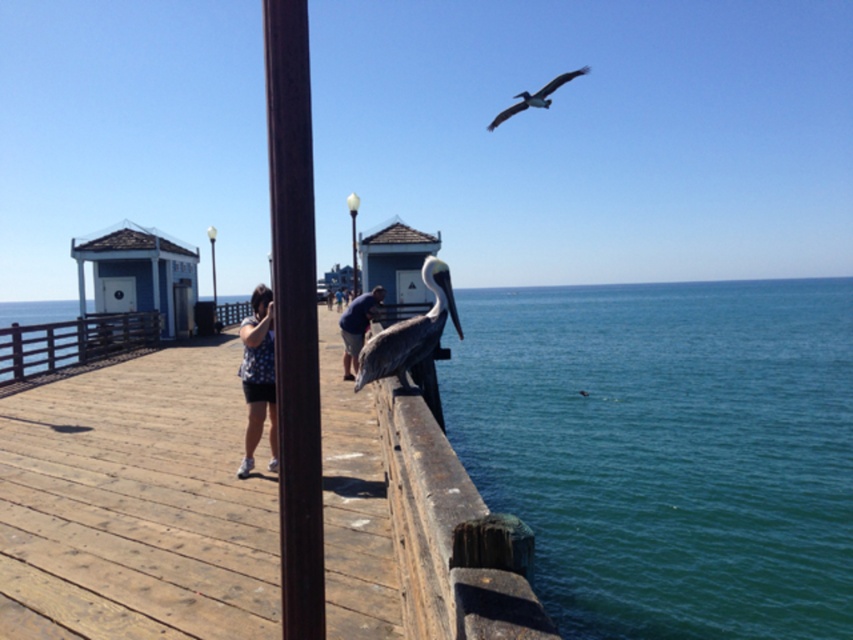
Question: Among these points, which one is nearest to the camera?

Choices:
 (A) (355, 314)
 (B) (258, 387)
 (C) (111, 355)
 (D) (306, 371)

Answer: (D)

Question: Observing the image, what is the correct spatial positioning of brown wooden dock at center in reference to brown wooden rail at center?

Choices:
 (A) above
 (B) below

Answer: (B)

Question: Is brown feathered pelican at center positioned at the back of dark blue shirt at center?

Choices:
 (A) no
 (B) yes

Answer: (A)

Question: Among these points, which one is nearest to the camera?

Choices:
 (A) (32, 520)
 (B) (398, 333)

Answer: (A)

Question: Which object is closer to the camera taking this photo?

Choices:
 (A) polka dot shirt at center
 (B) white glossy lamp post at center
 (C) brown wooden rail at center

Answer: (A)

Question: Is brown wooden dock at center wider than white glossy lamp post at center?

Choices:
 (A) yes
 (B) no

Answer: (A)